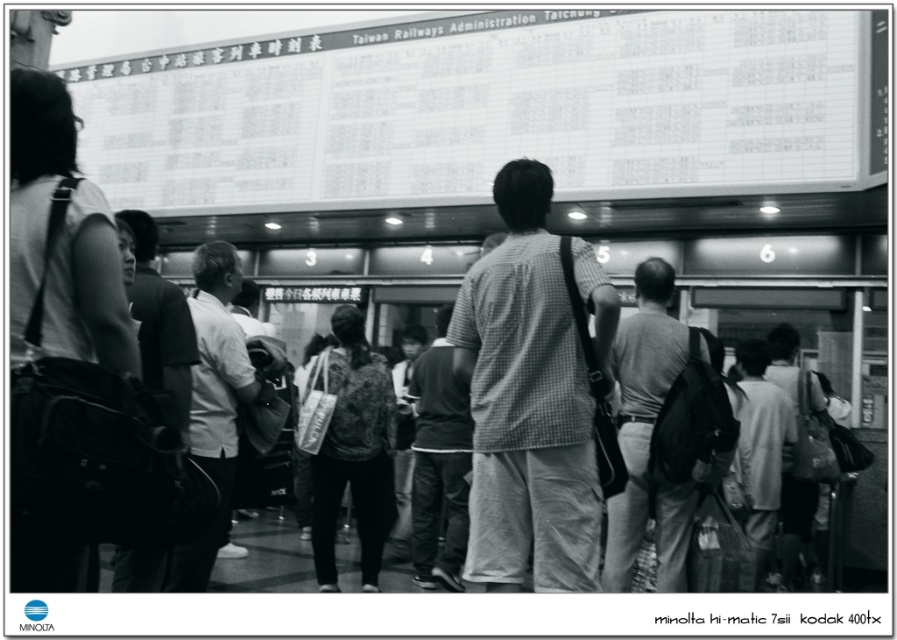
Question: Which object appears farthest from the camera in this image?

Choices:
 (A) white fabric shirt at center
 (B) checkered fabric shirt at center
 (C) dark gray textured pants at center

Answer: (C)

Question: Where is gray cotton shirt at center located in relation to white fabric shirt at center in the image?

Choices:
 (A) left
 (B) right

Answer: (B)

Question: Which object is farther from the camera taking this photo?

Choices:
 (A) dark gray backpack at center
 (B) gray cotton shirt at center
 (C) checkered fabric shirt at center
 (D) white fabric shirt at center

Answer: (B)

Question: Is gray cotton shirt at center above white fabric shirt at center?

Choices:
 (A) yes
 (B) no

Answer: (B)

Question: Is white fabric shirt at center positioned at the back of dark gray backpack at center?

Choices:
 (A) no
 (B) yes

Answer: (B)

Question: Which point is closer to the camera?

Choices:
 (A) (198, 368)
 (B) (628, 436)
 (C) (512, 448)
 (D) (172, 396)

Answer: (D)